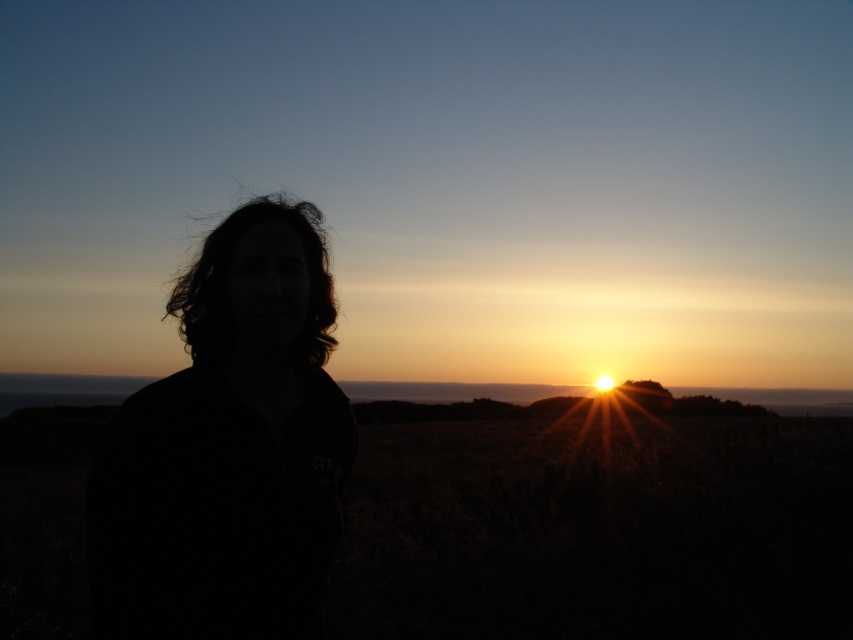
You are a photographer trying to capture the sunset scene. You notice two distinct hair silhouettes in the image. Which hair silhouette, the black matte hair at left or the dark curly hair at center, appears smaller in the photo?

The black matte hair at left appears smaller than the dark curly hair at center in the photo.